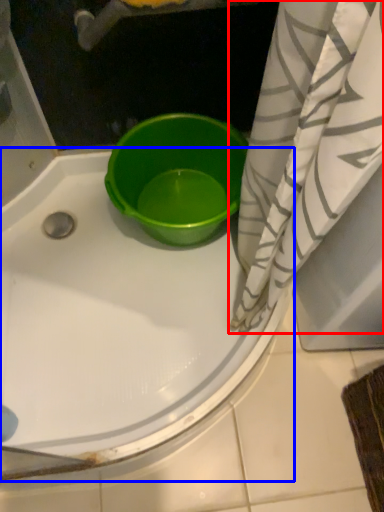
Question: Which object is closer to the camera taking this photo, curtain (highlighted by a red box) or bathtub (highlighted by a blue box)?

Choices:
 (A) curtain
 (B) bathtub

Answer: (B)